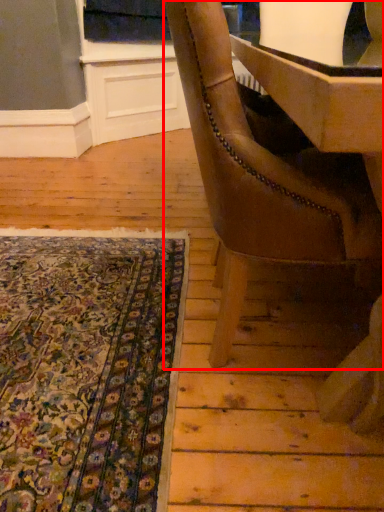
Question: In this image, where is chair (annotated by the red box) located relative to mat?

Choices:
 (A) left
 (B) right

Answer: (B)